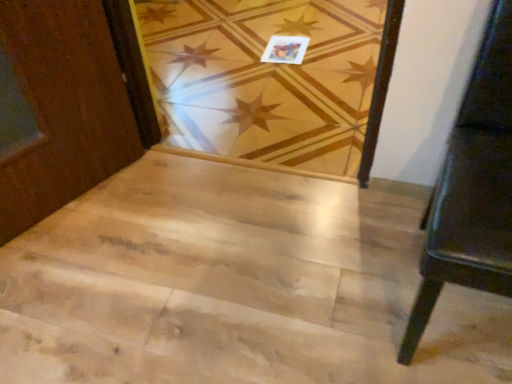
Find the location of `blank space above natural wood stairwell at center (from a real-world perspective)`. blank space above natural wood stairwell at center (from a real-world perspective) is located at coordinates (211, 254).